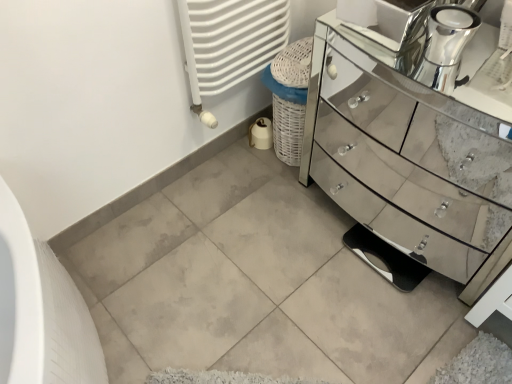
What do you see at coordinates (410, 155) in the screenshot?
I see `mirror-finished glass chest of drawers at right` at bounding box center [410, 155].

What are the coordinates of `chrome metallic faucet at upper right` in the screenshot? It's located at (446, 47).

I want to click on mirror-finished glass chest of drawers at right, so click(x=410, y=155).

Does point (279, 1) appear closer or farther from the camera than point (415, 101)?

Point (279, 1) appears to be closer to the viewer than point (415, 101).

Which is more to the right, white textured radiator at upper center or mirror-finished glass chest of drawers at right?

mirror-finished glass chest of drawers at right is more to the right.

Are white textured radiator at upper center and mirror-finished glass chest of drawers at right far apart?

They are positioned close to each other.

Can you confirm if white textured radiator at upper center is thinner than mirror-finished glass chest of drawers at right?

Correct, the width of white textured radiator at upper center is less than that of mirror-finished glass chest of drawers at right.

From a real-world perspective, who is located lower, chrome metallic faucet at upper right or mirror-finished glass chest of drawers at right?

From a 3D spatial view, mirror-finished glass chest of drawers at right is below.

What are the coordinates of `chest of drawers on the right side of chrome metallic faucet at upper right` in the screenshot? It's located at (410, 155).

Is chrome metallic faucet at upper right turned away from mirror-finished glass chest of drawers at right?

No, chrome metallic faucet at upper right's orientation is not away from mirror-finished glass chest of drawers at right.

Is mirror-finished glass chest of drawers at right not within chrome metallic faucet at upper right?

mirror-finished glass chest of drawers at right is positioned outside chrome metallic faucet at upper right.

Visually, is mirror-finished glass chest of drawers at right positioned to the left or to the right of chrome metallic faucet at upper right?

In the image, mirror-finished glass chest of drawers at right appears on the right side of chrome metallic faucet at upper right.

Could you tell me if mirror-finished glass chest of drawers at right is facing chrome metallic faucet at upper right?

No, mirror-finished glass chest of drawers at right is not turned towards chrome metallic faucet at upper right.

Is mirror-finished glass chest of drawers at right positioned far away from chrome metallic faucet at upper right?

That's not correct — mirror-finished glass chest of drawers at right is a little close to chrome metallic faucet at upper right.

Is chrome metallic faucet at upper right facing away from white textured radiator at upper center?

No, white textured radiator at upper center is not at the back of chrome metallic faucet at upper right.

This screenshot has height=384, width=512. I want to click on radiator below the chrome metallic faucet at upper right (from a real-world perspective), so click(229, 43).

Does chrome metallic faucet at upper right have a lesser width compared to white textured radiator at upper center?

Indeed, chrome metallic faucet at upper right has a lesser width compared to white textured radiator at upper center.

Which object is further away from the camera, chrome metallic faucet at upper right or white textured radiator at upper center?

white textured radiator at upper center is further away from the camera.

Considering the relative sizes of mirror-finished glass chest of drawers at right and white textured radiator at upper center in the image provided, is mirror-finished glass chest of drawers at right shorter than white textured radiator at upper center?

No, mirror-finished glass chest of drawers at right is not shorter than white textured radiator at upper center.

Locate an element on the screen. radiator behind the mirror-finished glass chest of drawers at right is located at coordinates (229, 43).

Is mirror-finished glass chest of drawers at right facing towards white textured radiator at upper center?

No, mirror-finished glass chest of drawers at right is not facing towards white textured radiator at upper center.

Is white textured radiator at upper center surrounded by mirror-finished glass chest of drawers at right?

No.

Is white textured radiator at upper center beside chrome metallic faucet at upper right?

No, white textured radiator at upper center is not beside chrome metallic faucet at upper right.

Does white textured radiator at upper center have a larger size compared to chrome metallic faucet at upper right?

Correct, white textured radiator at upper center is larger in size than chrome metallic faucet at upper right.

From a real-world perspective, which object stands above the other?

chrome metallic faucet at upper right is physically above.

Considering the relative positions of white textured radiator at upper center and chrome metallic faucet at upper right in the image provided, is white textured radiator at upper center to the left or to the right of chrome metallic faucet at upper right?

From the image, it's evident that white textured radiator at upper center is to the left of chrome metallic faucet at upper right.

Where is `radiator located behind the mirror-finished glass chest of drawers at right`? This screenshot has height=384, width=512. radiator located behind the mirror-finished glass chest of drawers at right is located at coordinates (229, 43).

Locate an element on the screen. The image size is (512, 384). the chest of drawers beneath the chrome metallic faucet at upper right (from a real-world perspective) is located at coordinates (410, 155).

Estimate the real-world distances between objects in this image. Which object is further from chrome metallic faucet at upper right, mirror-finished glass chest of drawers at right or white textured radiator at upper center?

The object further to chrome metallic faucet at upper right is white textured radiator at upper center.

Looking at the image, which one is located closer to mirror-finished glass chest of drawers at right, white textured radiator at upper center or chrome metallic faucet at upper right?

Based on the image, white textured radiator at upper center appears to be nearer to mirror-finished glass chest of drawers at right.

Consider the image. From the image, which object appears to be nearer to mirror-finished glass chest of drawers at right, chrome metallic faucet at upper right or white textured radiator at upper center?

white textured radiator at upper center lies closer to mirror-finished glass chest of drawers at right than the other object.

From the image, which object appears to be farther from white textured radiator at upper center, chrome metallic faucet at upper right or mirror-finished glass chest of drawers at right?

chrome metallic faucet at upper right is further to white textured radiator at upper center.

In the scene shown: From the image, which object appears to be nearer to chrome metallic faucet at upper right, white textured radiator at upper center or mirror-finished glass chest of drawers at right?

Among the two, mirror-finished glass chest of drawers at right is located nearer to chrome metallic faucet at upper right.

Which object lies further to the anchor point white textured radiator at upper center, mirror-finished glass chest of drawers at right or chrome metallic faucet at upper right?

chrome metallic faucet at upper right.

I want to click on coffee machine between white textured radiator at upper center and mirror-finished glass chest of drawers at right, so [446, 47].